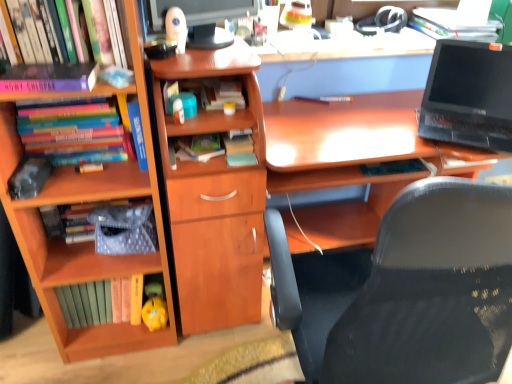
Question: Is hardcover book at center, the 5th book in the left-to-right sequence, turned away from matte black laptop at upper right, placed as the sixth book when sorted from left to right?

Choices:
 (A) yes
 (B) no

Answer: (B)

Question: Is hardcover book at center, the 2th book when ordered from right to left, placed right next to matte black laptop at upper right, the first book when ordered from right to left?

Choices:
 (A) no
 (B) yes

Answer: (A)

Question: Does hardcover book at center, the 2th book when ordered from right to left, appear on the left side of matte black laptop at upper right, placed as the sixth book when sorted from left to right?

Choices:
 (A) no
 (B) yes

Answer: (B)

Question: Is hardcover book at center, the 5th book in the left-to-right sequence, located outside matte black laptop at upper right, the first book when ordered from right to left?

Choices:
 (A) yes
 (B) no

Answer: (A)

Question: From the image's perspective, is hardcover book at center, the 5th book in the left-to-right sequence, under matte black laptop at upper right, placed as the sixth book when sorted from left to right?

Choices:
 (A) yes
 (B) no

Answer: (A)

Question: Does hardcover book at center, the 2th book when ordered from right to left, have a greater height compared to matte black laptop at upper right, placed as the sixth book when sorted from left to right?

Choices:
 (A) no
 (B) yes

Answer: (A)

Question: Is the position of matte black monitor at upper center more distant than that of matte black laptop at upper right, the first book when ordered from right to left?

Choices:
 (A) no
 (B) yes

Answer: (A)

Question: Does matte black monitor at upper center appear on the right side of matte black laptop at upper right, the first book when ordered from right to left?

Choices:
 (A) yes
 (B) no

Answer: (B)

Question: Considering the relative positions of matte black monitor at upper center and matte black laptop at upper right, the first book when ordered from right to left, in the image provided, is matte black monitor at upper center in front of matte black laptop at upper right, the first book when ordered from right to left,?

Choices:
 (A) yes
 (B) no

Answer: (A)

Question: Is matte black monitor at upper center not within matte black laptop at upper right, the first book when ordered from right to left?

Choices:
 (A) no
 (B) yes

Answer: (B)

Question: Is matte black monitor at upper center next to matte black laptop at upper right, the first book when ordered from right to left?

Choices:
 (A) yes
 (B) no

Answer: (B)

Question: Is matte black monitor at upper center oriented away from matte black laptop at upper right, placed as the sixth book when sorted from left to right?

Choices:
 (A) no
 (B) yes

Answer: (A)

Question: Does yellow matte piggy bank at lower center have a lesser width compared to matte black laptop at upper right, placed as the sixth book when sorted from left to right?

Choices:
 (A) no
 (B) yes

Answer: (B)